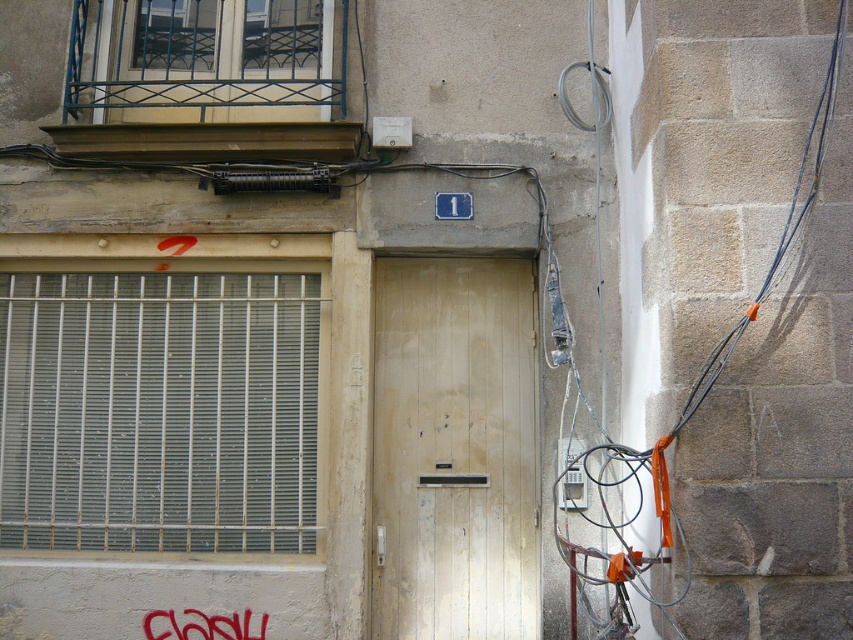
In the scene shown: Who is lower down, orange fabric at right or brushed metal graffiti at lower left?

brushed metal graffiti at lower left is lower down.

Who is higher up, orange fabric at right or brushed metal graffiti at lower left?

orange fabric at right is above.

Image resolution: width=853 pixels, height=640 pixels. Identify the location of orange fabric at right. (724, 397).

Locate an element on the screen. The height and width of the screenshot is (640, 853). orange fabric at right is located at coordinates (724, 397).

Which is more to the right, white wood door at center or brushed metal graffiti at lower left?

Positioned to the right is white wood door at center.

Which is above, white wood door at center or brushed metal graffiti at lower left?

white wood door at center is above.

Image resolution: width=853 pixels, height=640 pixels. Find the location of `white wood door at center`. white wood door at center is located at coordinates (454, 451).

Identify the location of white wood door at center. (454, 451).

Looking at this image, does orange fabric at right have a smaller size compared to white wood door at center?

No.

Is orange fabric at right bigger than white wood door at center?

Indeed, orange fabric at right has a larger size compared to white wood door at center.

Where is `orange fabric at right`? The image size is (853, 640). orange fabric at right is located at coordinates (724, 397).